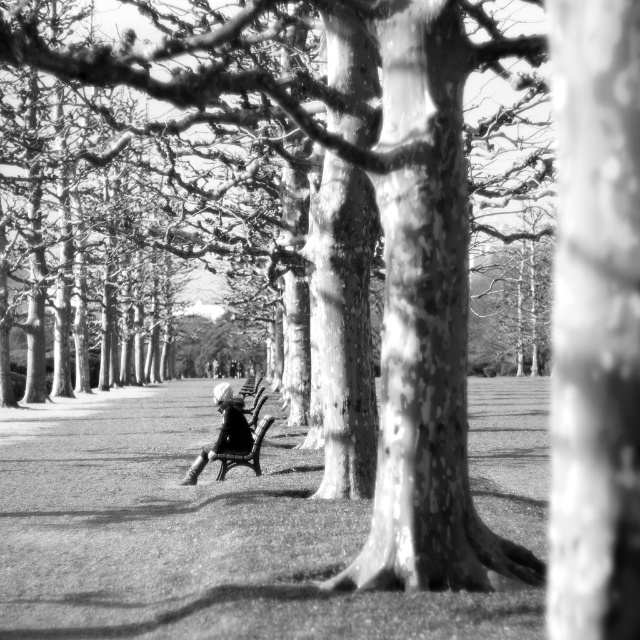
Can you confirm if white fabric jacket at center is taller than black wood bench at center?

Correct, white fabric jacket at center is much taller as black wood bench at center.

Is point (243, 416) positioned before point (220, 456)?

No, (243, 416) is behind (220, 456).

Identify the location of white fabric jacket at center. (224, 433).